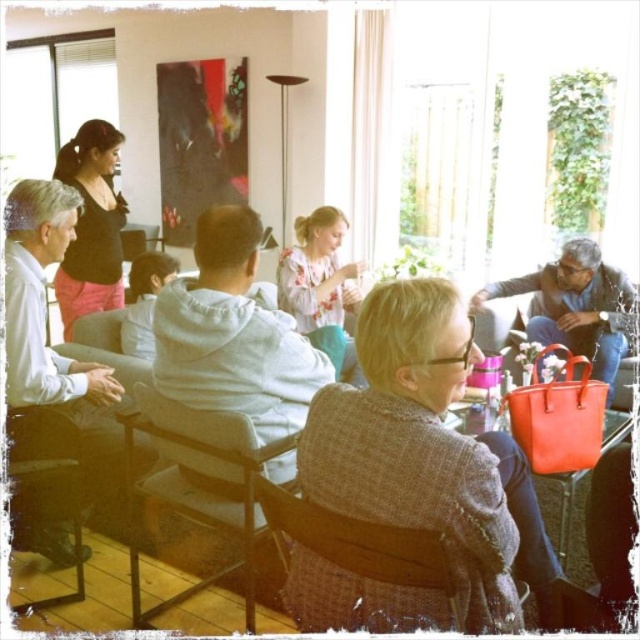
Question: Which is farther from the floral blouse at center?

Choices:
 (A) matte black top at upper left
 (B) woven fabric chair at center
 (C) wooden chair at center
 (D) wooden chair at lower left

Answer: (B)

Question: Which of the following is the closest to the observer?

Choices:
 (A) (349, 550)
 (B) (177, 508)
 (C) (58, 458)
 (D) (305, 250)

Answer: (A)

Question: Among these points, which one is nearest to the camera?

Choices:
 (A) (333, 305)
 (B) (120, 253)

Answer: (B)

Question: Is wooden chair at center in front of matte black top at upper left?

Choices:
 (A) yes
 (B) no

Answer: (A)

Question: Can you confirm if wooden chair at center is wider than matte black top at upper left?

Choices:
 (A) yes
 (B) no

Answer: (A)

Question: Is wooden chair at center to the left of woven fabric chair at center from the viewer's perspective?

Choices:
 (A) yes
 (B) no

Answer: (A)